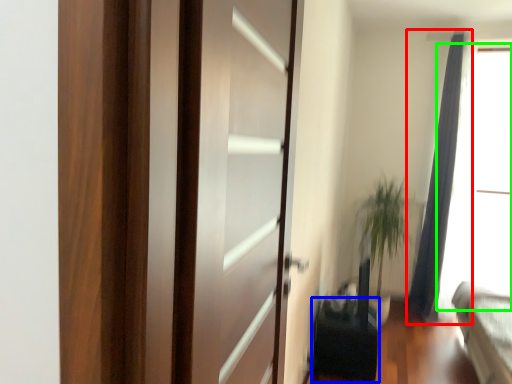
Question: Which object is positioned farthest from curtain (highlighted by a red box)? Select from furniture (highlighted by a blue box) and window screen (highlighted by a green box).

Choices:
 (A) furniture
 (B) window screen

Answer: (A)